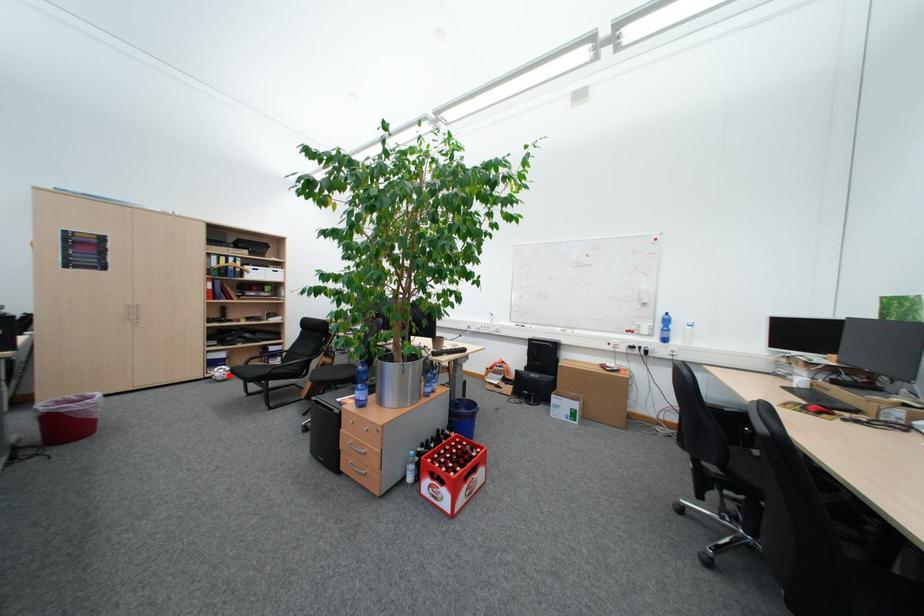
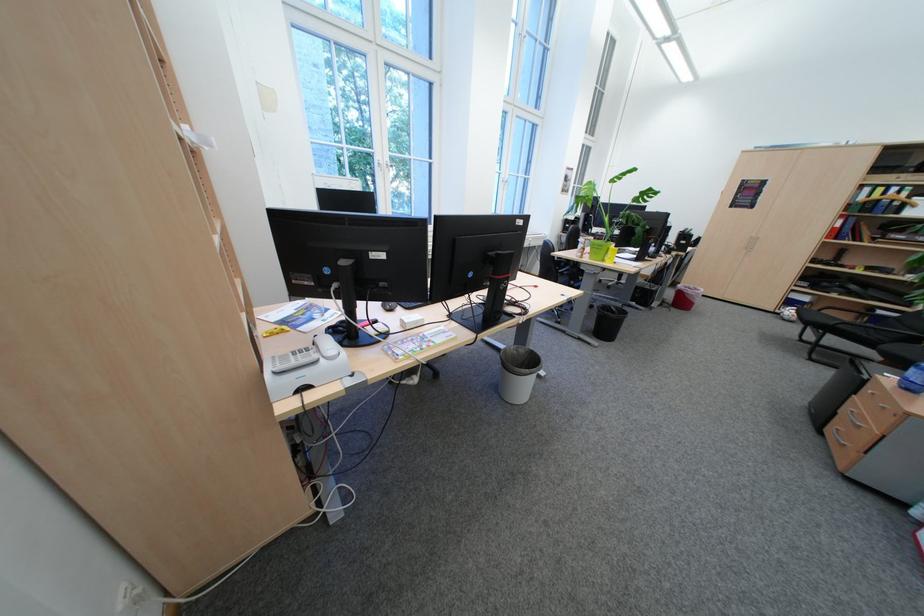
In the second image, find the point that corresponds to the highlighted location in the first image.

(798, 314)